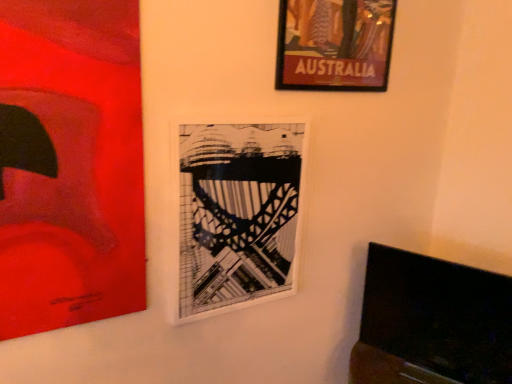
Question: From the image's perspective, would you say wooden-framed poster at upper right, arranged as the third picture frame when viewed from the left, is shown under white matte picture frame at center, which ranks as the 2th picture frame in left-to-right order?

Choices:
 (A) yes
 (B) no

Answer: (B)

Question: Is wooden-framed poster at upper right, positioned as the 1th picture frame in right-to-left order, to the left of white matte picture frame at center, which ranks as the 2th picture frame in left-to-right order, from the viewer's perspective?

Choices:
 (A) no
 (B) yes

Answer: (A)

Question: Does wooden-framed poster at upper right, positioned as the 1th picture frame in right-to-left order, have a larger size compared to white matte picture frame at center, which ranks as the 2th picture frame in left-to-right order?

Choices:
 (A) no
 (B) yes

Answer: (A)

Question: From a real-world perspective, is wooden-framed poster at upper right, arranged as the third picture frame when viewed from the left, beneath white matte picture frame at center, which ranks as the 2th picture frame in left-to-right order?

Choices:
 (A) no
 (B) yes

Answer: (A)

Question: Considering the relative sizes of wooden-framed poster at upper right, positioned as the 1th picture frame in right-to-left order, and white matte picture frame at center, which is the second picture frame from right to left, in the image provided, is wooden-framed poster at upper right, positioned as the 1th picture frame in right-to-left order, wider than white matte picture frame at center, which is the second picture frame from right to left,?

Choices:
 (A) yes
 (B) no

Answer: (A)

Question: Considering the positions of matte red painting at left, which appears as the first picture frame when viewed from the left, and wooden-framed poster at upper right, positioned as the 1th picture frame in right-to-left order, in the image, is matte red painting at left, which appears as the first picture frame when viewed from the left, bigger or smaller than wooden-framed poster at upper right, positioned as the 1th picture frame in right-to-left order,?

Choices:
 (A) big
 (B) small

Answer: (A)

Question: From their relative heights in the image, would you say matte red painting at left, which appears as the 3th picture frame when viewed from the right, is taller or shorter than wooden-framed poster at upper right, positioned as the 1th picture frame in right-to-left order?

Choices:
 (A) tall
 (B) short

Answer: (A)

Question: From the image's perspective, is matte red painting at left, which appears as the first picture frame when viewed from the left, above or below wooden-framed poster at upper right, arranged as the third picture frame when viewed from the left?

Choices:
 (A) below
 (B) above

Answer: (A)

Question: Considering the relative positions of matte red painting at left, which appears as the 3th picture frame when viewed from the right, and wooden-framed poster at upper right, arranged as the third picture frame when viewed from the left, in the image provided, is matte red painting at left, which appears as the 3th picture frame when viewed from the right, to the left or to the right of wooden-framed poster at upper right, arranged as the third picture frame when viewed from the left,?

Choices:
 (A) right
 (B) left

Answer: (B)

Question: Is wooden-framed poster at upper right, positioned as the 1th picture frame in right-to-left order, inside the boundaries of white matte picture frame at center, which ranks as the 2th picture frame in left-to-right order, or outside?

Choices:
 (A) inside
 (B) outside

Answer: (B)

Question: Considering the positions of wooden-framed poster at upper right, arranged as the third picture frame when viewed from the left, and white matte picture frame at center, which ranks as the 2th picture frame in left-to-right order, in the image, is wooden-framed poster at upper right, arranged as the third picture frame when viewed from the left, bigger or smaller than white matte picture frame at center, which ranks as the 2th picture frame in left-to-right order,?

Choices:
 (A) small
 (B) big

Answer: (A)

Question: Relative to white matte picture frame at center, which ranks as the 2th picture frame in left-to-right order, is wooden-framed poster at upper right, arranged as the third picture frame when viewed from the left, in front or behind?

Choices:
 (A) front
 (B) behind

Answer: (B)

Question: From a real-world perspective, relative to white matte picture frame at center, which is the second picture frame from right to left, is wooden-framed poster at upper right, arranged as the third picture frame when viewed from the left, vertically above or below?

Choices:
 (A) above
 (B) below

Answer: (A)

Question: From the image's perspective, is white matte picture frame at center, which is the second picture frame from right to left, located above or below matte red painting at left, which appears as the first picture frame when viewed from the left?

Choices:
 (A) below
 (B) above

Answer: (A)

Question: Is white matte picture frame at center, which is the second picture frame from right to left, wider or thinner than matte red painting at left, which appears as the first picture frame when viewed from the left?

Choices:
 (A) wide
 (B) thin

Answer: (B)